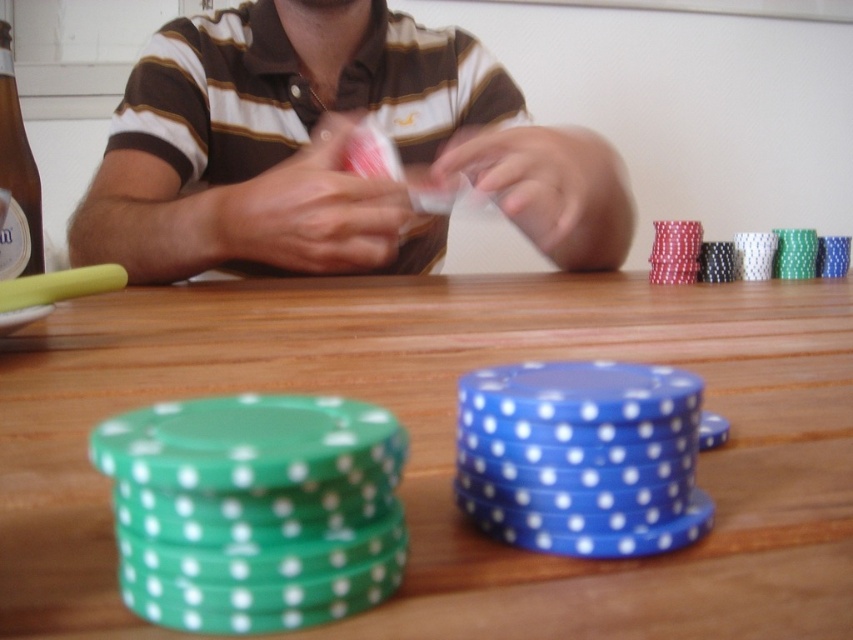
You are a poker player sitting at the table and want to place your drink between the green plastic chips at lower left and the matte brown shirt at upper center. Is there enough vertical space between them to fit a standard 15 cm tall glass?

The green plastic chips at lower left is shorter than matte brown shirt at upper center, so there is enough vertical space between them to fit a standard 15 cm tall glass.

You are sitting at the poker table and need to place a bet. There are two points marked on the table surface where you can place your chips. The first point is at coordinate point(x=751, y=618) and the second point is at coordinate point(x=404, y=74). Which point is closer to you?

Point(x=751, y=618) is in front of point(x=404, y=74), so the point at coordinate point(x=751, y=618) is closer to you.

You are a dealer at a poker table. You need to place a 10.5 inch long poker card deck between the green plastic chips at lower left and the matte brown shirt at upper center. Is there enough space?

The distance between the green plastic chips at lower left and the matte brown shirt at upper center is 9.36 inches. Since the poker card deck is 10.5 inches long, it would not fit in the available space.